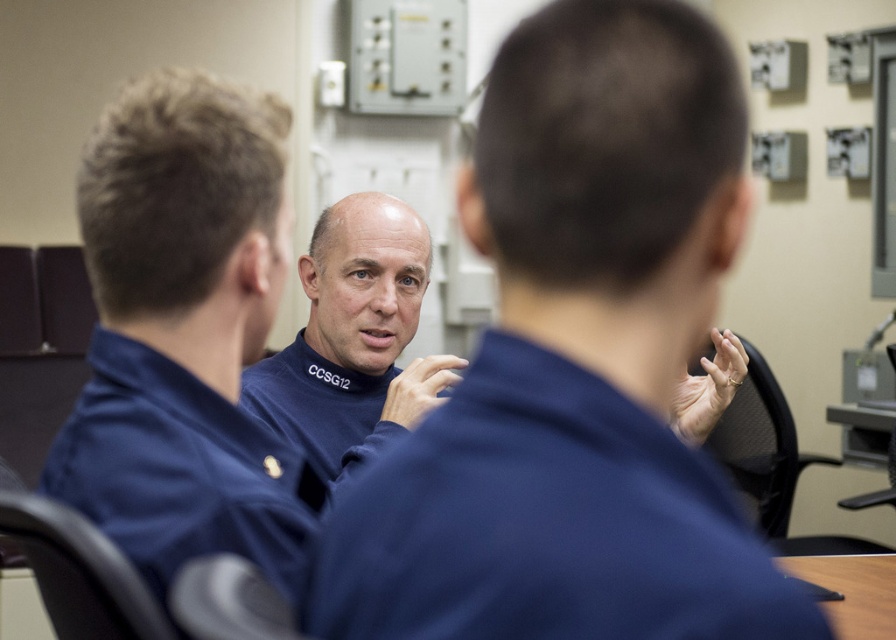
You are a photographer standing in front of the group. You need to take a photo that includes both the blue fabric shirt at center and the blue fleece sweater at center. Which object should you focus on first to ensure both are in frame?

The blue fabric shirt at center is not as tall as the blue fleece sweater at center, so you should focus on the blue fleece sweater at center first to ensure both are in frame.

You are a photographer trying to capture a group photo of the blue fabric shirt at center and the blue fleece sweater at center. Since you want them both to be in the frame, which side should you stand to ensure both are visible?

The blue fabric shirt at center is positioned on the left side of blue fleece sweater at center. Therefore, to capture both in the frame, you should stand to the right side of the blue fleece sweater at center so that you can see both the left side of the blue fabric shirt at center and the right side of the blue fleece sweater at center.

You are standing in the room and want to reach the point marked at coordinates point (259, 144). If you take one step forward of 2 feet, will you be closer than 3 feet to that point?

The distance between you and point (259, 144) is 37.24 inches. After taking a 24 inch step forward, the remaining distance would be 13.24 inches, which is less than 36 inches. Therefore, yes, you will be within 3 feet of the point.